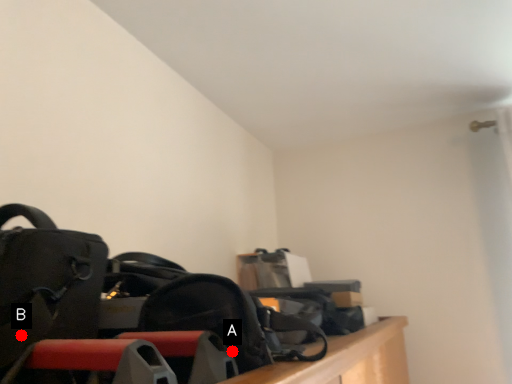
Question: Two points are circled on the image, labeled by A and B beside each circle. Which point is closer to the camera?

Choices:
 (A) A is closer
 (B) B is closer

Answer: (B)